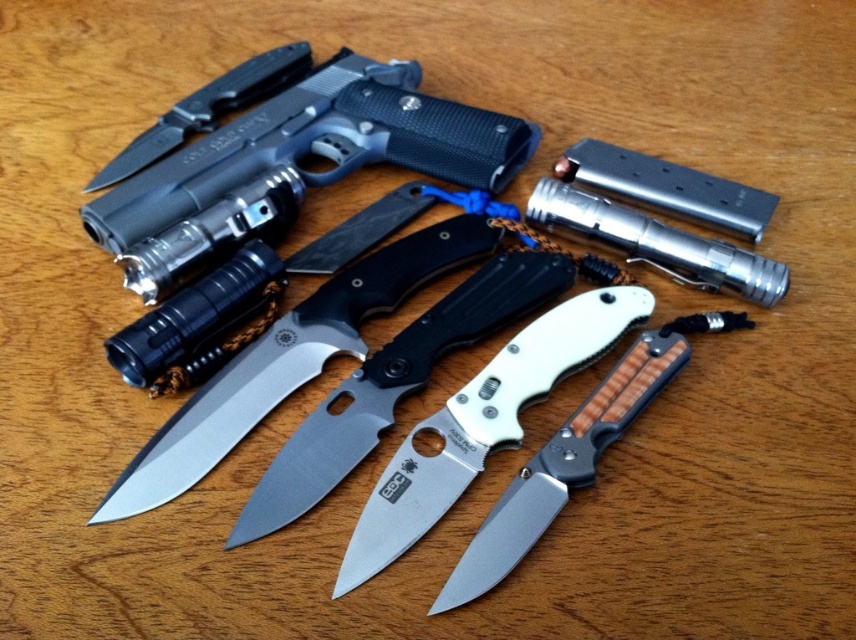
Who is more distant from viewer, [354,352] or [205,120]?

Point [205,120]

Does silver metallic knife at center have a lesser height compared to matte black knife at center?

Incorrect, silver metallic knife at center's height does not fall short of matte black knife at center's.

Measure the distance between silver metallic knife at center and camera.

silver metallic knife at center is 4.00 feet from camera.

The image size is (856, 640). In order to click on silver metallic knife at center in this screenshot , I will do `click(287, 362)`.

Is silver metallic folding knife at center above satin finish knife at center?

Actually, silver metallic folding knife at center is below satin finish knife at center.

Based on the photo, does silver metallic folding knife at center have a larger size compared to satin finish knife at center?

Incorrect, silver metallic folding knife at center is not larger than satin finish knife at center.

Where is `silver metallic folding knife at center`? silver metallic folding knife at center is located at coordinates (483, 422).

Locate an element on the screen. This screenshot has width=856, height=640. silver metallic folding knife at center is located at coordinates (483, 422).

Can you confirm if silver metallic knife at center is wider than silver metallic folding knife at center?

Yes, silver metallic knife at center is wider than silver metallic folding knife at center.

Who is more distant from viewer, [191,422] or [559,323]?

The point [559,323] is more distant.

Find the location of `silver metallic knife at center`. silver metallic knife at center is located at coordinates (287, 362).